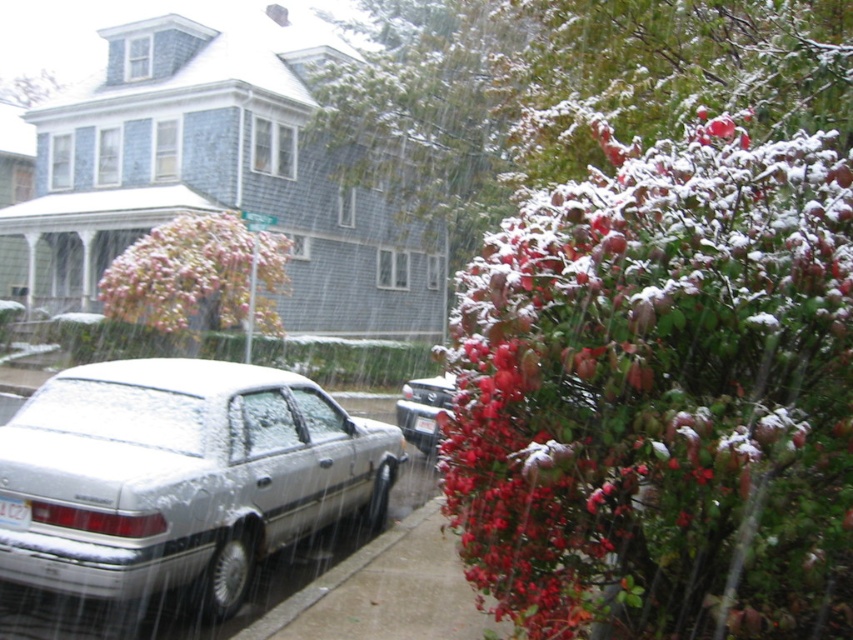
Which is below, gray concrete curb at lower left or white plastic license plate at center?

gray concrete curb at lower left

Does gray concrete curb at lower left have a greater width compared to white plastic license plate at center?

Yes.

Identify the location of gray concrete curb at lower left. (335, 576).

Between pink textured bush at upper left and gray concrete curb at lower left, which one is positioned lower?

gray concrete curb at lower left is lower down.

Image resolution: width=853 pixels, height=640 pixels. Describe the element at coordinates (198, 275) in the screenshot. I see `pink textured bush at upper left` at that location.

This screenshot has width=853, height=640. I want to click on pink textured bush at upper left, so click(x=198, y=275).

Does satin silver sedan at center have a smaller size compared to white plastic license plate at center?

No, satin silver sedan at center is not smaller than white plastic license plate at center.

Is satin silver sedan at center positioned in front of white plastic license plate at center?

Yes, satin silver sedan at center is closer to the viewer.

The width and height of the screenshot is (853, 640). What do you see at coordinates (181, 476) in the screenshot?
I see `satin silver sedan at center` at bounding box center [181, 476].

Find the location of a particular element. satin silver sedan at center is located at coordinates (181, 476).